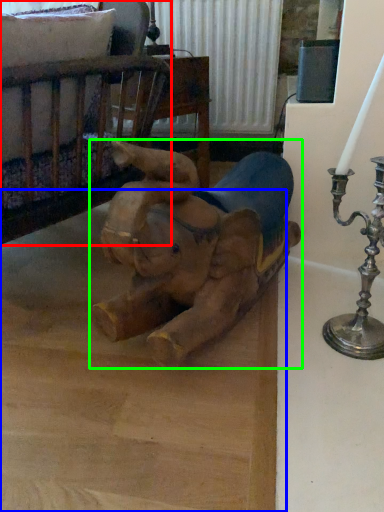
Question: Which object is positioned farthest from furniture (highlighted by a red box)? Select from cardboard (highlighted by a blue box) and toy (highlighted by a green box).

Choices:
 (A) cardboard
 (B) toy

Answer: (A)